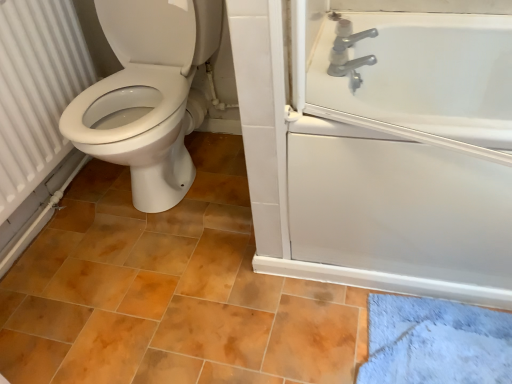
Identify the location of free space to the back side of silver metallic faucet at upper right. (328, 53).